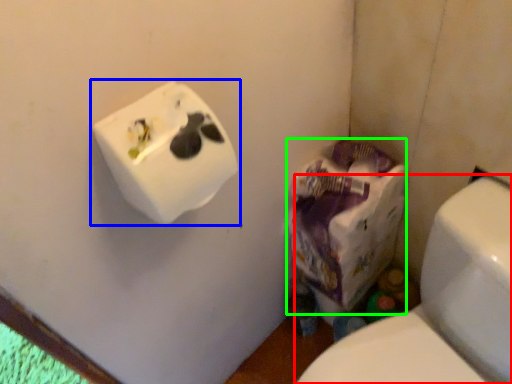
Question: Which object is positioned farthest from toilet (highlighted by a red box)? Select from toilet paper (highlighted by a blue box) and paper bag (highlighted by a green box).

Choices:
 (A) toilet paper
 (B) paper bag

Answer: (A)